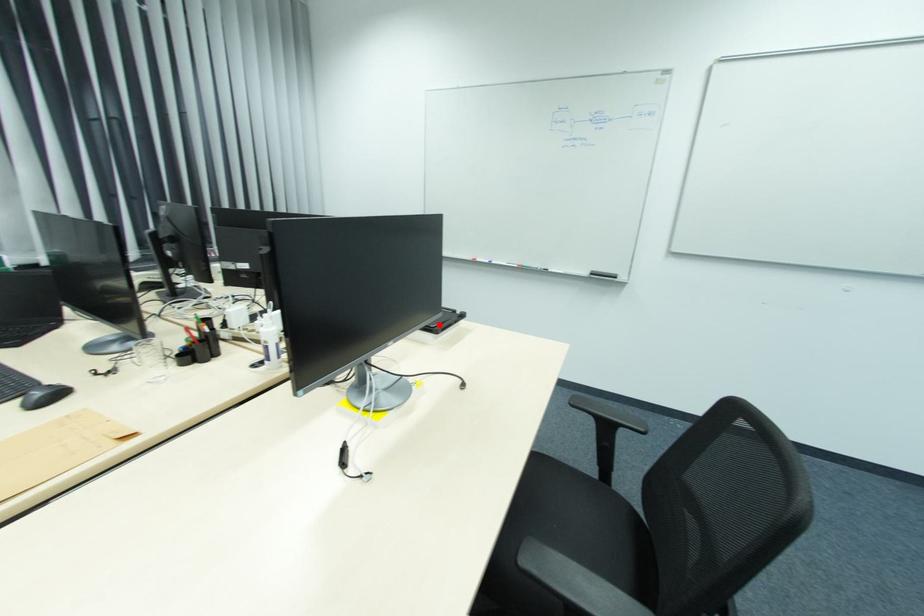
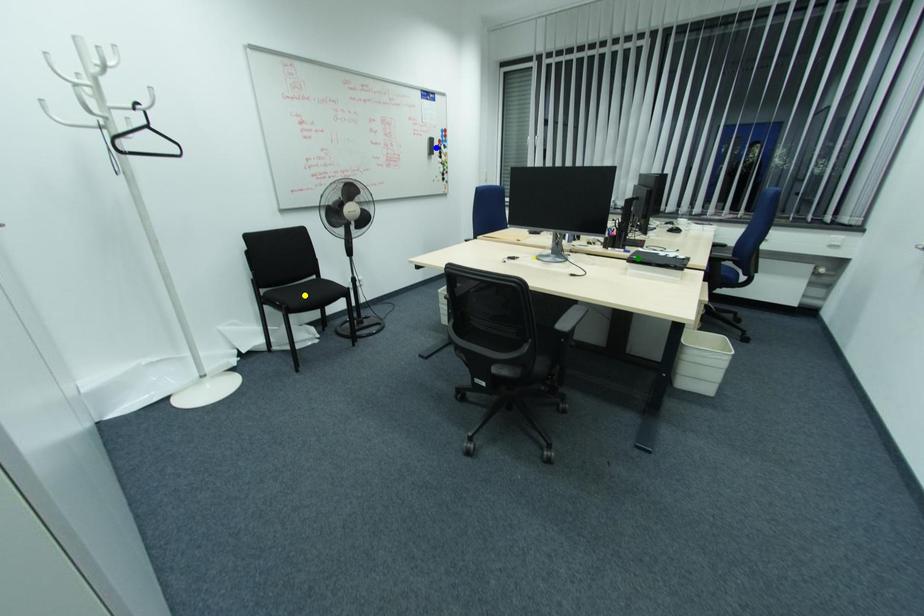
Question: I am providing you with two images of the same scene from different viewpoints. A red point is marked on the first image. You are given multiple points on the second image. Can you choose the point in image 2 that corresponds to the point in image 1?

Choices:
 (A) blue point
 (B) yellow point
 (C) green point

Answer: (C)